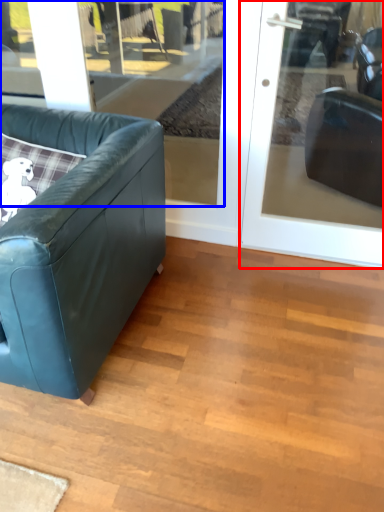
Question: Among these objects, which one is nearest to the camera, door (highlighted by a red box) or window (highlighted by a blue box)?

Choices:
 (A) door
 (B) window

Answer: (A)